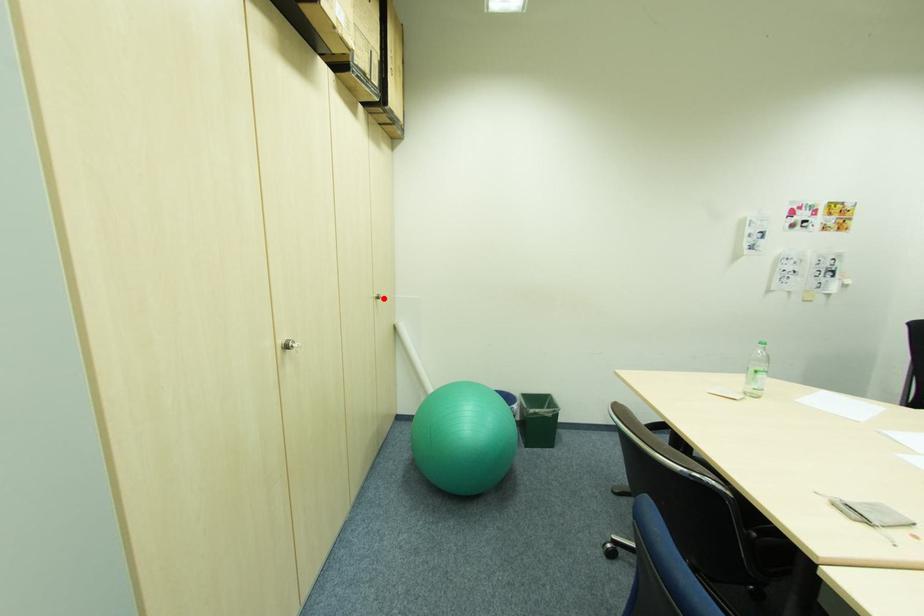
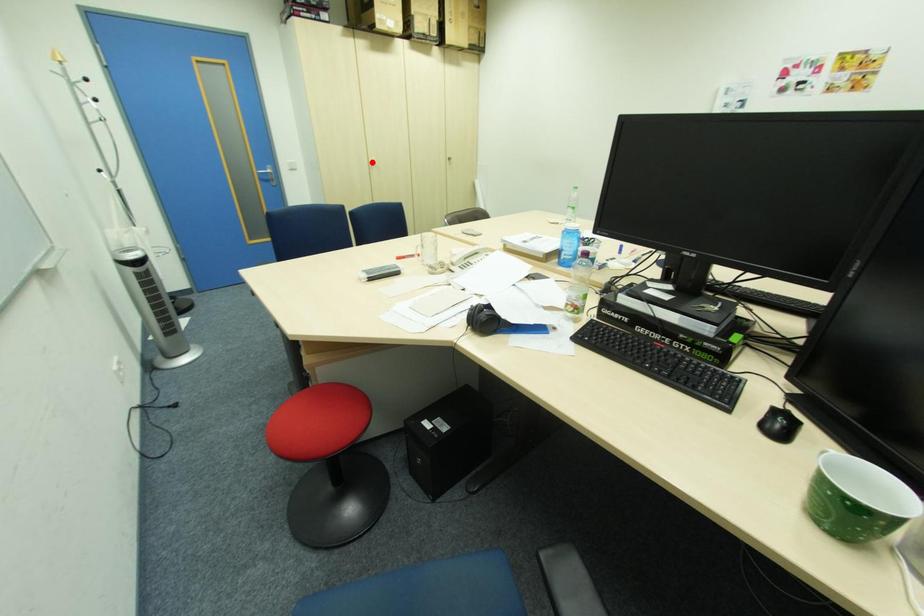
I am providing you with two images of the same scene from different viewpoints. A red point is marked on the first image and another point is marked on the second image. Do the highlighted points in image1 and image2 indicate the same real-world spot?

No